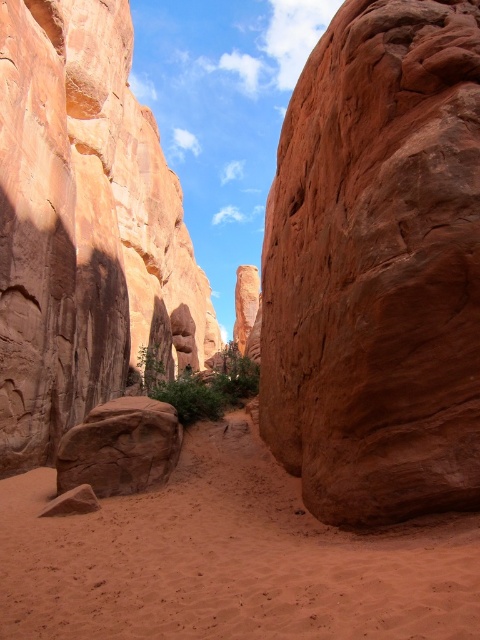
Question: Considering the real-world distances, which object is farthest from the rustic sandstone rock at center?

Choices:
 (A) rustic sandstone boulder at lower left
 (B) smooth sandstone boulder at left
 (C) sandy/dry sand at center

Answer: (B)

Question: Is rustic sandstone rock at center closer to camera compared to smooth sandstone boulder at left?

Choices:
 (A) no
 (B) yes

Answer: (B)

Question: Is sandy/dry sand at center below rustic sandstone boulder at lower left?

Choices:
 (A) no
 (B) yes

Answer: (B)

Question: Which point is closer to the camera?

Choices:
 (A) (129, 467)
 (B) (107, 605)
 (C) (105, 33)

Answer: (B)

Question: Considering the relative positions of rustic sandstone rock at center and smooth sandstone boulder at left in the image provided, where is rustic sandstone rock at center located with respect to smooth sandstone boulder at left?

Choices:
 (A) right
 (B) left

Answer: (A)

Question: Which point is closer to the camera?

Choices:
 (A) smooth sandstone boulder at left
 (B) sandy/dry sand at center

Answer: (B)